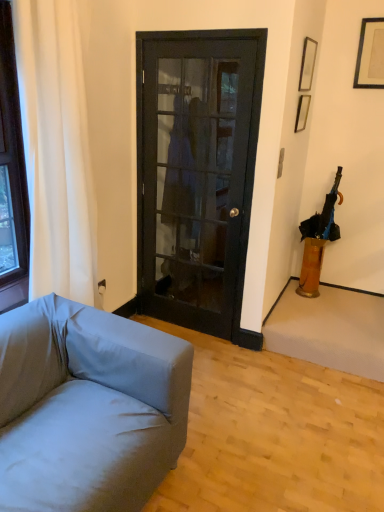
Question: Is white fabric curtain at left smaller than black matte picture frame at upper right, the 3th picture frame in the left-to-right sequence?

Choices:
 (A) no
 (B) yes

Answer: (A)

Question: Considering the relative sizes of white fabric curtain at left and black matte picture frame at upper right, the 3th picture frame in the left-to-right sequence, in the image provided, is white fabric curtain at left shorter than black matte picture frame at upper right, the 3th picture frame in the left-to-right sequence,?

Choices:
 (A) no
 (B) yes

Answer: (A)

Question: Is white fabric curtain at left positioned far away from black matte picture frame at upper right, the 1th picture frame when ordered from right to left?

Choices:
 (A) yes
 (B) no

Answer: (A)

Question: Is white fabric curtain at left at the right side of black matte picture frame at upper right, the 1th picture frame when ordered from right to left?

Choices:
 (A) yes
 (B) no

Answer: (B)

Question: Does white fabric curtain at left come behind black matte picture frame at upper right, the 3th picture frame in the left-to-right sequence?

Choices:
 (A) yes
 (B) no

Answer: (B)

Question: From a real-world perspective, relative to translucent amber vase at right, is black matte picture frame at upper right, the 1th picture frame when ordered from right to left, vertically above or below?

Choices:
 (A) above
 (B) below

Answer: (A)

Question: Looking at their shapes, would you say black matte picture frame at upper right, the 1th picture frame when ordered from right to left, is wider or thinner than translucent amber vase at right?

Choices:
 (A) wide
 (B) thin

Answer: (B)

Question: Visually, is black matte picture frame at upper right, the 3th picture frame in the left-to-right sequence, positioned to the left or to the right of translucent amber vase at right?

Choices:
 (A) left
 (B) right

Answer: (B)

Question: Is point (379, 22) closer or farther from the camera than point (316, 266)?

Choices:
 (A) farther
 (B) closer

Answer: (B)

Question: Considering the relative positions of matte black picture frame at upper right, the 2th picture frame in the left-to-right sequence, and light gray fabric couch at lower left in the image provided, is matte black picture frame at upper right, the 2th picture frame in the left-to-right sequence, to the left or to the right of light gray fabric couch at lower left?

Choices:
 (A) left
 (B) right

Answer: (B)

Question: From a real-world perspective, is matte black picture frame at upper right, the 2th picture frame in the left-to-right sequence, physically located above or below light gray fabric couch at lower left?

Choices:
 (A) above
 (B) below

Answer: (A)

Question: Based on their sizes in the image, would you say matte black picture frame at upper right, which appears as the second picture frame when viewed from the right, is bigger or smaller than light gray fabric couch at lower left?

Choices:
 (A) small
 (B) big

Answer: (A)

Question: Considering the positions of matte black picture frame at upper right, which appears as the second picture frame when viewed from the right, and light gray fabric couch at lower left in the image, is matte black picture frame at upper right, which appears as the second picture frame when viewed from the right, wider or thinner than light gray fabric couch at lower left?

Choices:
 (A) thin
 (B) wide

Answer: (A)

Question: Based on their sizes in the image, would you say black glass door at center is bigger or smaller than black fabric umbrella at right?

Choices:
 (A) small
 (B) big

Answer: (B)

Question: In terms of height, does black glass door at center look taller or shorter compared to black fabric umbrella at right?

Choices:
 (A) tall
 (B) short

Answer: (A)